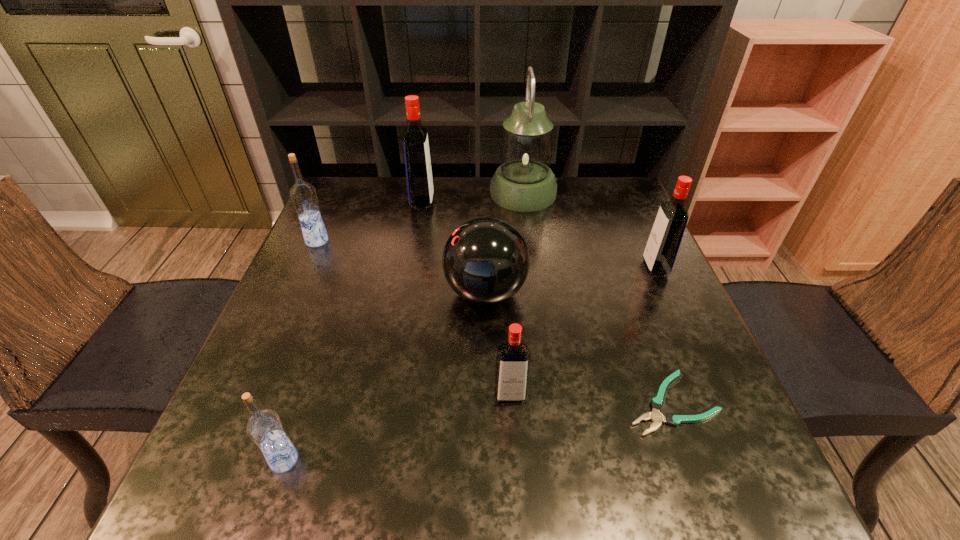
The image size is (960, 540). Find the location of `lantern`. lantern is located at coordinates (524, 182).

Where is `the leftmost red vodka`? The width and height of the screenshot is (960, 540). the leftmost red vodka is located at coordinates (419, 179).

Where is `the third vodka from right to left`? The height and width of the screenshot is (540, 960). the third vodka from right to left is located at coordinates (419, 179).

Where is `the second biggest red vodka`? The image size is (960, 540). the second biggest red vodka is located at coordinates (665, 238).

Identify the location of the third nearest vodka. (665, 238).

I want to click on the leftmost vodka, so click(303, 195).

This screenshot has height=540, width=960. What are the coordinates of `the sixth nearest object` in the screenshot? It's located at (303, 195).

I want to click on bowling ball, so click(486, 261).

What are the coordinates of `the fourth vodka from left to right` in the screenshot? It's located at (512, 367).

The image size is (960, 540). I want to click on the smallest red vodka, so click(512, 367).